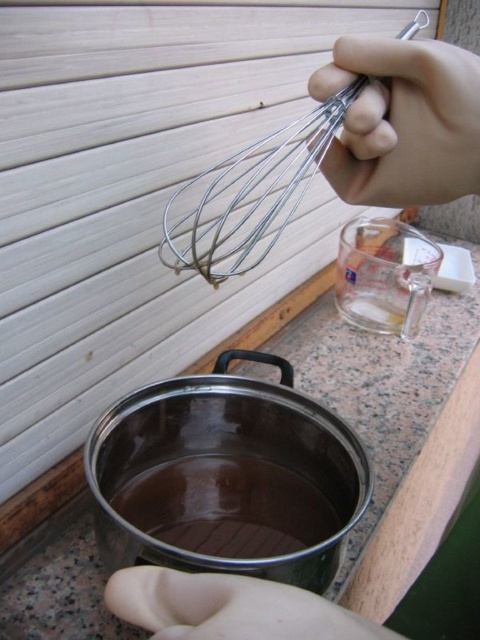
Is metallic wire whisk at upper center to the left of transparent glass liquid at center from the viewer's perspective?

No, metallic wire whisk at upper center is not to the left of transparent glass liquid at center.

At what (x,y) coordinates should I click in order to perform the action: click on metallic wire whisk at upper center. Please return your answer as a coordinate pair (x, y). This screenshot has width=480, height=640. Looking at the image, I should click on (250, 195).

Does metallic whisk at upper center appear under transparent glass liquid at center?

No.

Locate an element on the screen. The width and height of the screenshot is (480, 640). metallic whisk at upper center is located at coordinates (403, 122).

Who is more forward, [385,156] or [196,529]?

Positioned in front is point [385,156].

Find the location of a particular element. This screenshot has height=640, width=480. metallic whisk at upper center is located at coordinates [403, 122].

Does metallic wire whisk at upper center have a lesser height compared to skinny white hand at center?

In fact, metallic wire whisk at upper center may be taller than skinny white hand at center.

Which is below, metallic wire whisk at upper center or skinny white hand at center?

skinny white hand at center is lower down.

I want to click on metallic wire whisk at upper center, so click(x=250, y=195).

You are a GUI agent. You are given a task and a screenshot of the screen. Output one action in this format:
    pyautogui.click(x=<x>, y=<y>)
    Task: Click on the metallic wire whisk at upper center
    
    Given the screenshot: What is the action you would take?
    pyautogui.click(x=250, y=195)